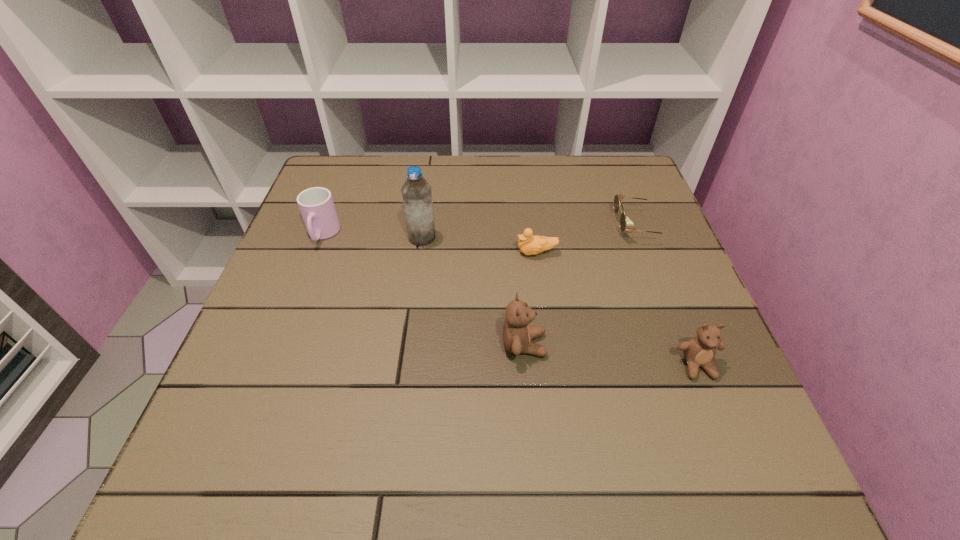
The image size is (960, 540). I want to click on empty location between the fifth shortest object and the right teddy bear, so pos(611,355).

This screenshot has height=540, width=960. I want to click on vacant region between the duckling and the left teddy bear, so click(530, 299).

Locate an element on the screen. vacant space that's between the shorter teddy bear and the left teddy bear is located at coordinates (611, 355).

The width and height of the screenshot is (960, 540). I want to click on free spot between the cup and the tallest object, so click(372, 236).

Locate an element on the screen. This screenshot has width=960, height=540. vacant region between the second tallest object and the duckling is located at coordinates (530, 299).

Locate an element on the screen. The image size is (960, 540). free space that is in between the sunglasses and the duckling is located at coordinates (588, 240).

Image resolution: width=960 pixels, height=540 pixels. In order to click on empty space that is in between the leftmost object and the sunglasses in this screenshot , I will do `click(481, 231)`.

The width and height of the screenshot is (960, 540). Identify the location of empty space between the right teddy bear and the duckling. (617, 309).

You are a GUI agent. You are given a task and a screenshot of the screen. Output one action in this format:
    pyautogui.click(x=<x>, y=<y>)
    Task: Click on the free spot between the sunglasses and the leftmost object
    
    Given the screenshot: What is the action you would take?
    pyautogui.click(x=481, y=231)

Locate an element on the screen. The image size is (960, 540). vacant area between the shorter teddy bear and the duckling is located at coordinates (617, 309).